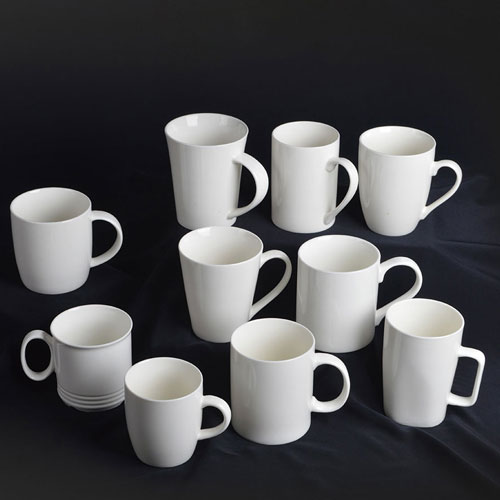
This screenshot has width=500, height=500. In order to click on handle of cup in this screenshot , I will do `click(119, 234)`, `click(26, 356)`, `click(224, 427)`, `click(342, 395)`, `click(280, 288)`, `click(260, 184)`, `click(354, 173)`, `click(460, 169)`, `click(413, 269)`, `click(479, 377)`.